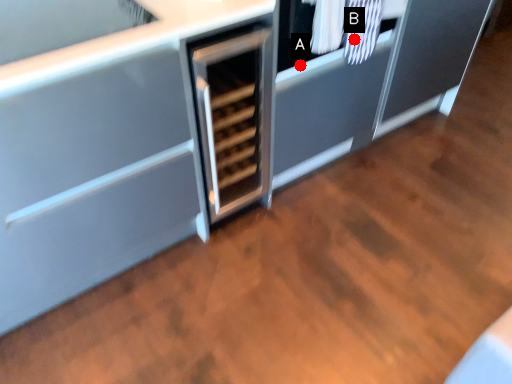
Question: Two points are circled on the image, labeled by A and B beside each circle. Among these points, which one is nearest to the camera?

Choices:
 (A) A is closer
 (B) B is closer

Answer: (B)